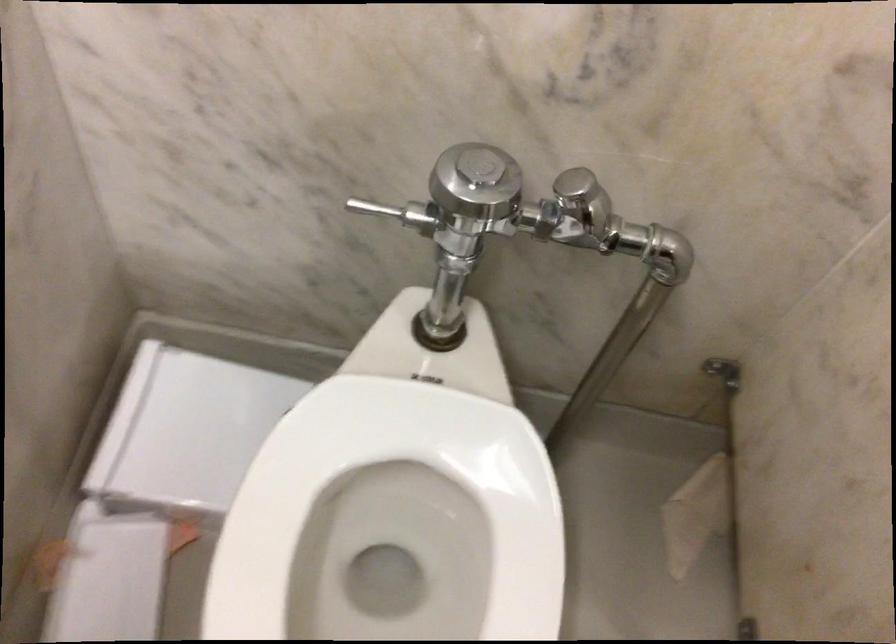
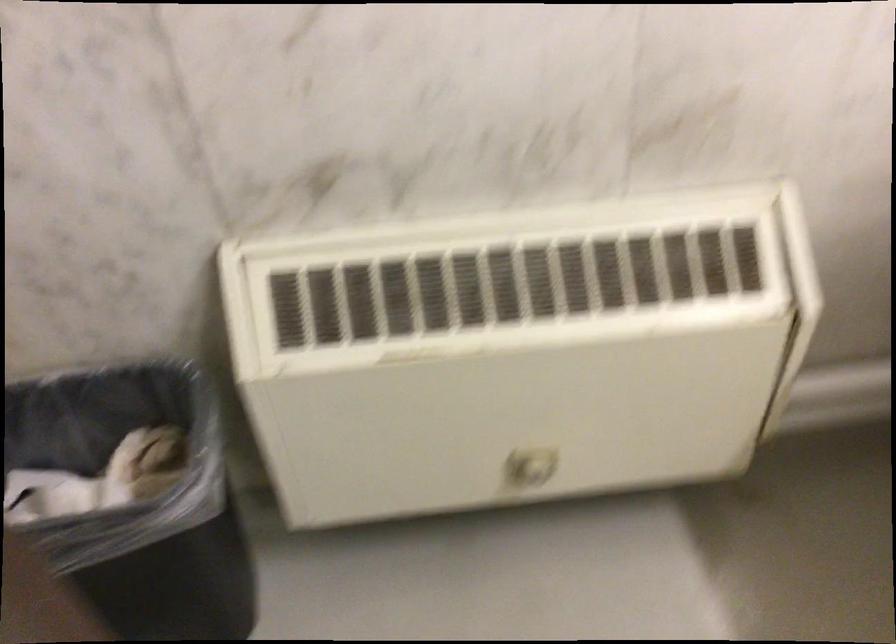
Question: The images are taken continuously from a first-person perspective. In which direction are you moving?

Choices:
 (A) Left
 (B) Right
 (C) Forward
 (D) Backward

Answer: (B)